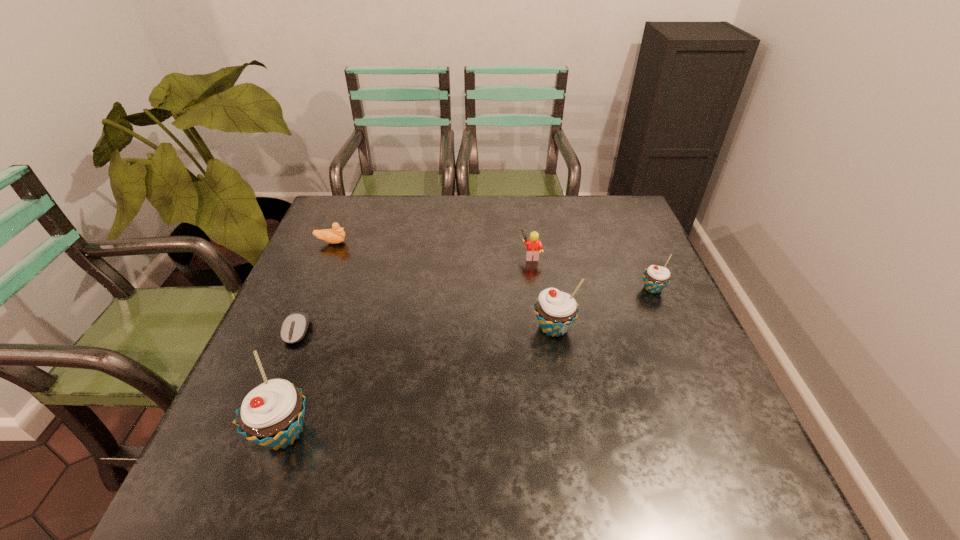
The image size is (960, 540). Find the location of `free space between the Lego and the farthest object`. free space between the Lego and the farthest object is located at coordinates (431, 249).

Identify the location of free space that is in between the farthest object and the rightmost object. (492, 266).

Locate an element on the screen. Image resolution: width=960 pixels, height=540 pixels. unoccupied area between the nearest object and the second farthest object is located at coordinates (407, 344).

Locate an element on the screen. The image size is (960, 540). unoccupied area between the farthest cupcake and the farthest object is located at coordinates (492, 266).

I want to click on unoccupied area between the second farthest object and the rightmost cupcake, so click(x=592, y=272).

What are the coordinates of `vacant space that is in between the second tallest object and the rightmost cupcake` in the screenshot? It's located at click(x=603, y=308).

The height and width of the screenshot is (540, 960). I want to click on vacant area between the fifth tallest object and the second tallest cupcake, so click(x=443, y=285).

At what (x,y) coordinates should I click in order to perform the action: click on free area in between the Lego and the computer equipment. Please return your answer as a coordinate pair (x, y). The image size is (960, 540). Looking at the image, I should click on (415, 293).

In order to click on empty location between the duckling and the second nearest cupcake in this screenshot , I will do `click(443, 285)`.

At what (x,y) coordinates should I click in order to perform the action: click on the closest object to the second shortest cupcake. Please return your answer as a coordinate pair (x, y). Image resolution: width=960 pixels, height=540 pixels. Looking at the image, I should click on (534, 246).